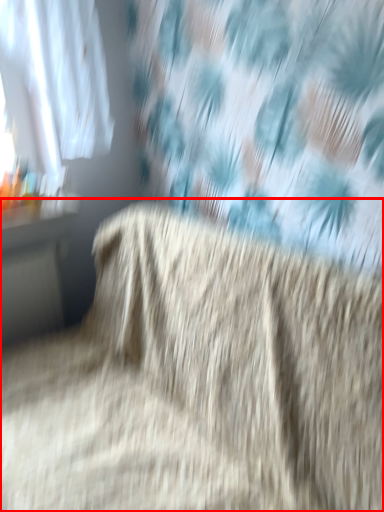
Question: Considering the relative positions of furniture (annotated by the red box) and table in the image provided, where is furniture (annotated by the red box) located with respect to the staircase?

Choices:
 (A) left
 (B) right

Answer: (B)